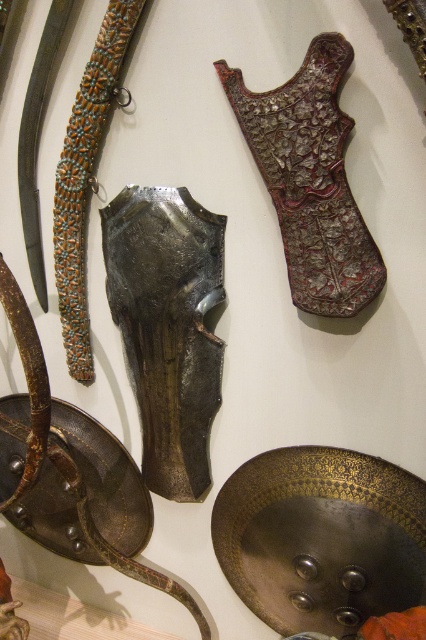
Question: Is metallic armor at center in front of carved wood armor at center?

Choices:
 (A) no
 (B) yes

Answer: (A)

Question: Does polished metal sword at center have a larger size compared to polished silver sword at left?

Choices:
 (A) yes
 (B) no

Answer: (A)

Question: Among these objects, which one is farthest from the camera?

Choices:
 (A) polished silver sword at left
 (B) metallic armor at center
 (C) carved wood armor at center

Answer: (A)

Question: Is metallic armor at center to the right of polished silver sword at left from the viewer's perspective?

Choices:
 (A) yes
 (B) no

Answer: (A)

Question: Which object is farther from the camera taking this photo?

Choices:
 (A) polished silver sword at left
 (B) metallic armor at center

Answer: (A)

Question: Which of the following is the farthest from the observer?

Choices:
 (A) (37, 227)
 (B) (108, 88)
 (C) (178, 396)

Answer: (A)